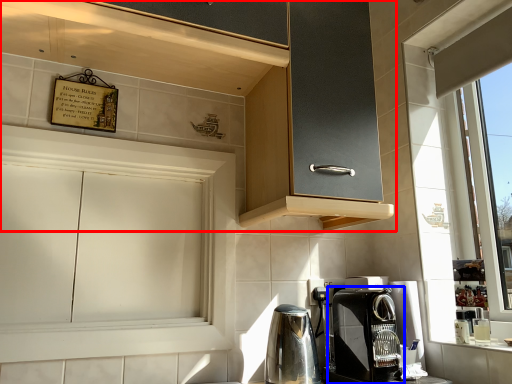
Question: Which object appears closest to the camera in this image, cabinetry (highlighted by a red box) or coffee maker (highlighted by a blue box)?

Choices:
 (A) cabinetry
 (B) coffee maker

Answer: (A)